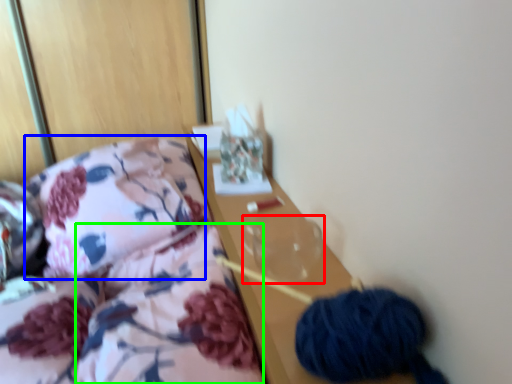
Question: Based on their relative distances, which object is farther from glass vase (highlighted by a red box)? Choose from throw pillow (highlighted by a blue box) and quilt (highlighted by a green box).

Choices:
 (A) throw pillow
 (B) quilt

Answer: (A)